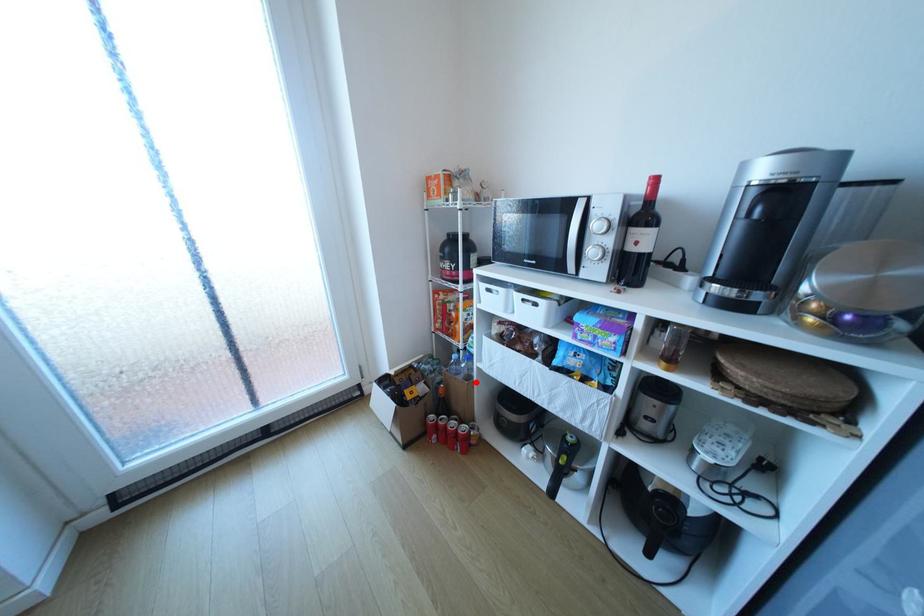
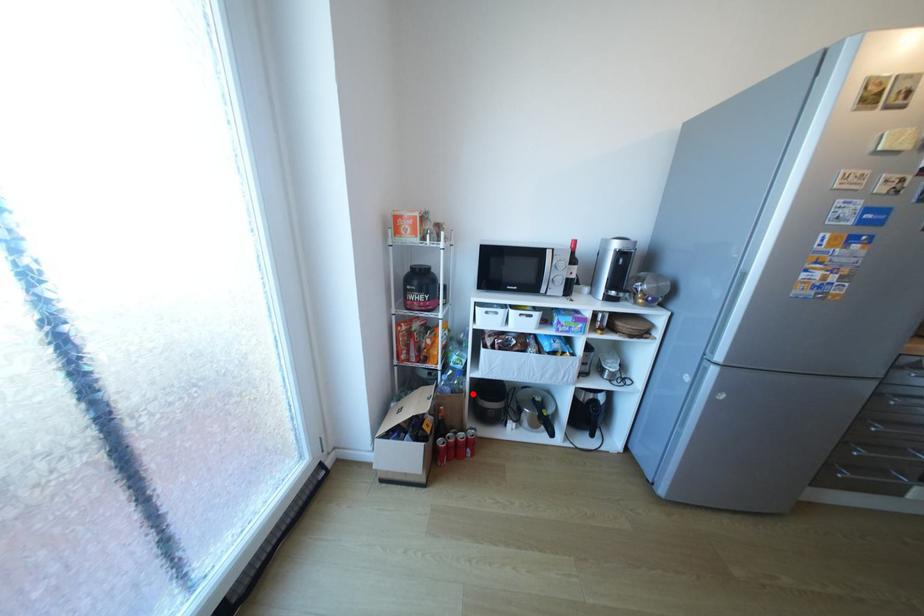
I am providing you with two images of the same scene from different viewpoints. A red point is marked on the first image and another point is marked on the second image. Does the point marked in image1 correspond to the same location as the one in image2?

Yes